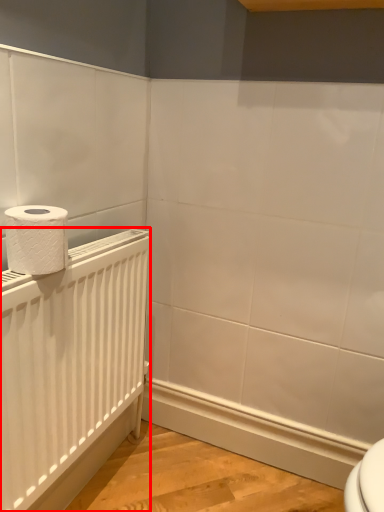
Question: From the image's perspective, what is the correct spatial positioning of radiator (annotated by the red box) in reference to toilet paper?

Choices:
 (A) below
 (B) above

Answer: (A)